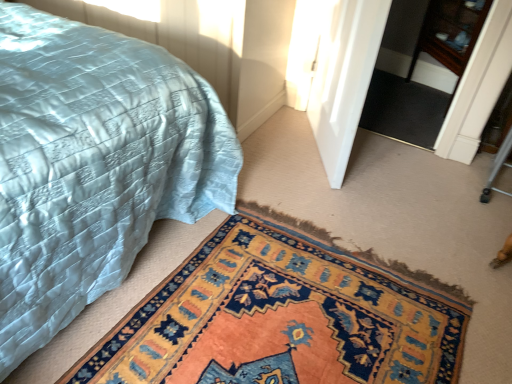
What do you see at coordinates (404, 109) in the screenshot? I see `black carpet at center` at bounding box center [404, 109].

Measure the distance between white glossy door at center and camera.

1.54 meters.

Where is `white glossy door at center`? white glossy door at center is located at coordinates (344, 78).

I want to click on carpeted mat at lower center, so click(x=280, y=319).

Is matte blue quilt at lower left wider than carpeted mat at lower center?

Indeed, matte blue quilt at lower left has a greater width compared to carpeted mat at lower center.

Can we say matte blue quilt at lower left lies outside carpeted mat at lower center?

Yes.

Is matte blue quilt at lower left not near carpeted mat at lower center?

No.

Are carpeted mat at lower center and wooden dresser at upper right making contact?

They are not placed beside each other.

Is carpeted mat at lower center outside of wooden dresser at upper right?

carpeted mat at lower center lies outside wooden dresser at upper right's area.

Is carpeted mat at lower center further to the viewer compared to wooden dresser at upper right?

No, carpeted mat at lower center is closer to the viewer.

From a real-world perspective, is carpeted mat at lower center beneath wooden dresser at upper right?

Yes, from a real-world perspective, carpeted mat at lower center is under wooden dresser at upper right.

This screenshot has width=512, height=384. Identify the location of bed in front of the white glossy door at center. (93, 165).

Which is in front, white glossy door at center or matte blue quilt at lower left?

matte blue quilt at lower left is more forward.

From the image's perspective, is white glossy door at center positioned above or below matte blue quilt at lower left?

white glossy door at center is above matte blue quilt at lower left.

From a real-world perspective, relative to matte blue quilt at lower left, is white glossy door at center vertically above or below?

Clearly, from a real-world perspective, white glossy door at center is below matte blue quilt at lower left.

Who is bigger, black carpet at center or matte blue quilt at lower left?

Bigger between the two is matte blue quilt at lower left.

Locate an element on the screen. The image size is (512, 384). bed to the left of black carpet at center is located at coordinates (93, 165).

From a real-world perspective, between black carpet at center and matte blue quilt at lower left, who is vertically lower?

black carpet at center, from a real-world perspective.

Is wooden dresser at upper right in front of or behind matte blue quilt at lower left in the image?

Visually, wooden dresser at upper right is located behind matte blue quilt at lower left.

Does point (442, 82) come farther from viewer compared to point (195, 147)?

That is True.

Based on their sizes in the image, would you say wooden dresser at upper right is bigger or smaller than matte blue quilt at lower left?

Clearly, wooden dresser at upper right is smaller in size than matte blue quilt at lower left.

Can you confirm if carpeted mat at lower center is taller than white glossy door at center?

Incorrect, the height of carpeted mat at lower center is not larger of that of white glossy door at center.

Would you say carpeted mat at lower center is a long distance from white glossy door at center?

No, carpeted mat at lower center is not far away from white glossy door at center.

Locate an element on the screen. The height and width of the screenshot is (384, 512). door above the carpeted mat at lower center (from a real-world perspective) is located at coordinates (344, 78).

What's the angular difference between black carpet at center and wooden dresser at upper right's facing directions?

The facing directions of black carpet at center and wooden dresser at upper right are 98.1 degrees apart.

Is black carpet at center to the right of wooden dresser at upper right from the viewer's perspective?

In fact, black carpet at center is to the left of wooden dresser at upper right.

Who is bigger, black carpet at center or wooden dresser at upper right?

Bigger between the two is wooden dresser at upper right.

Where is `dresser that is above the black carpet at center (from a real-world perspective)`? dresser that is above the black carpet at center (from a real-world perspective) is located at coordinates (449, 37).

In order to click on mat that appears below the matte blue quilt at lower left (from the image's perspective) in this screenshot , I will do `click(280, 319)`.

Where is `mat below the wooden dresser at upper right (from a real-world perspective)`? This screenshot has height=384, width=512. mat below the wooden dresser at upper right (from a real-world perspective) is located at coordinates (280, 319).

Consider the image. From the image, which object appears to be nearer to wooden dresser at upper right, white glossy door at center or matte blue quilt at lower left?

Among the two, white glossy door at center is located nearer to wooden dresser at upper right.

Which object lies nearer to the anchor point black carpet at center, carpeted mat at lower center or white glossy door at center?

white glossy door at center lies closer to black carpet at center than the other object.

When comparing their distances from carpeted mat at lower center, does wooden dresser at upper right or black carpet at center seem closer?

black carpet at center is positioned closer to the anchor carpeted mat at lower center.

Based on their spatial positions, is black carpet at center or white glossy door at center closer to wooden dresser at upper right?

black carpet at center is positioned closer to the anchor wooden dresser at upper right.

Considering their positions, is wooden dresser at upper right positioned further to carpeted mat at lower center than matte blue quilt at lower left?

Among the two, wooden dresser at upper right is located further to carpeted mat at lower center.

Which object lies nearer to the anchor point wooden dresser at upper right, carpeted mat at lower center or white glossy door at center?

The object closer to wooden dresser at upper right is white glossy door at center.

In the scene shown: Looking at the image, which one is located further to white glossy door at center, matte blue quilt at lower left or black carpet at center?

Based on the image, matte blue quilt at lower left appears to be further to white glossy door at center.

Looking at this image, when comparing their distances from white glossy door at center, does wooden dresser at upper right or carpeted mat at lower center seem closer?

The object closer to white glossy door at center is carpeted mat at lower center.

I want to click on doormat between matte blue quilt at lower left and wooden dresser at upper right in the horizontal direction, so click(404, 109).

Locate an element on the screen. This screenshot has width=512, height=384. mat between matte blue quilt at lower left and white glossy door at center is located at coordinates (280, 319).

The height and width of the screenshot is (384, 512). Find the location of `door between carpeted mat at lower center and black carpet at center from front to back`. door between carpeted mat at lower center and black carpet at center from front to back is located at coordinates coord(344,78).

The image size is (512, 384). Find the location of `door between wooden dresser at upper right and carpeted mat at lower center vertically`. door between wooden dresser at upper right and carpeted mat at lower center vertically is located at coordinates (344, 78).